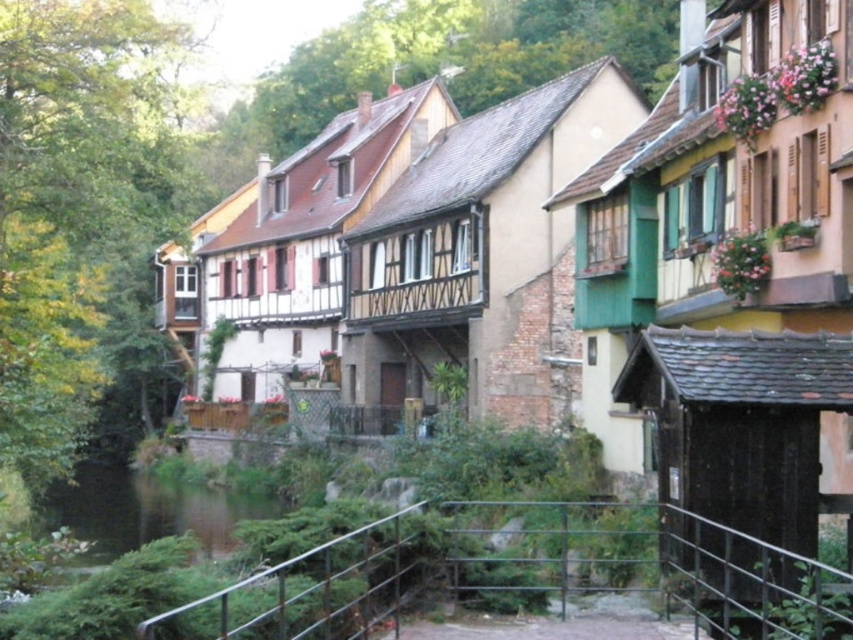
Question: Is metal/rusty rail at lower center thinner than green mossy river at lower left?

Choices:
 (A) no
 (B) yes

Answer: (B)

Question: Which of the following is the farthest from the observer?

Choices:
 (A) green mossy river at lower left
 (B) metal/rusty rail at lower center

Answer: (A)

Question: Where is metal/rusty rail at lower center located in relation to green mossy river at lower left in the image?

Choices:
 (A) left
 (B) right

Answer: (B)

Question: Observing the image, what is the correct spatial positioning of metal/rusty rail at lower center in reference to green mossy river at lower left?

Choices:
 (A) left
 (B) right

Answer: (B)

Question: Which of the following is the farthest from the observer?

Choices:
 (A) metal/rusty rail at lower center
 (B) green mossy river at lower left

Answer: (B)

Question: Which object is closer to the camera taking this photo?

Choices:
 (A) metal/rusty rail at lower center
 (B) green mossy river at lower left

Answer: (A)